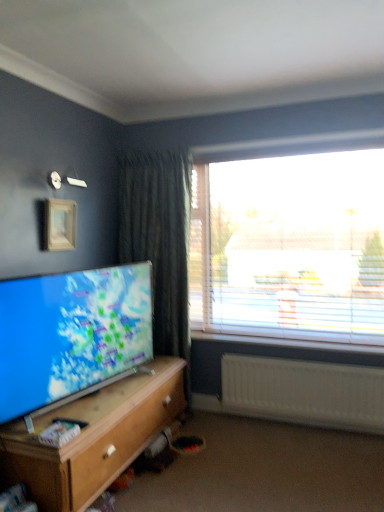
Locate an element on the screen. vacant space in matte screen tv at lower left (from a real-world perspective) is located at coordinates (117, 384).